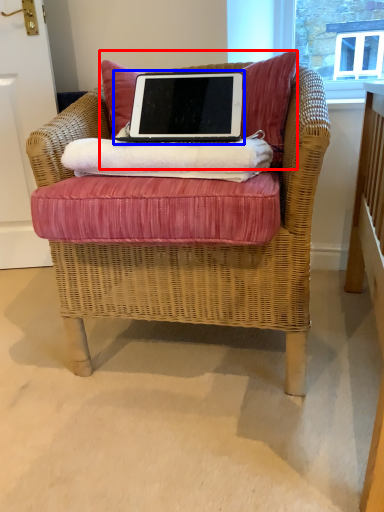
Question: Among these objects, which one is farthest to the camera, pillow (highlighted by a red box) or laptop (highlighted by a blue box)?

Choices:
 (A) pillow
 (B) laptop

Answer: (A)